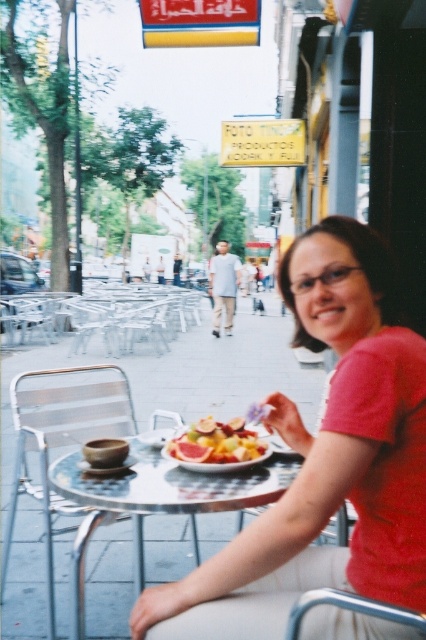
You are a photographer trying to capture a closeup shot of the matte red shirt at center without including the silver metallic chair at lower left in the frame. Based on their sizes, is this possible?

The matte red shirt at center has a lesser width compared to the silver metallic chair at lower left, so it is possible to capture a closeup shot of the matte red shirt at center without including the silver metallic chair at lower left in the frame.

You are a photographer setting up a tripod at the outdoor cafe. You need to place the tripod between the silver metallic chair at lower left and the clear glass table at center. The tripod requires a space that is at least as wide as the wider of the two objects. Which object determines the minimum width needed for the tripod placement?

The silver metallic chair at lower left might be wider than clear glass table at center, so the minimum width needed for the tripod placement should be based on the silver metallic chair at lower left to ensure it fits properly.

From the picture: You are a photographer setting up a tripod in the outdoor cafe. You need to position it between the silver metallic chair at lower left and the clear glass table at center. Is the space between them sufficient to place the tripod?

The clear glass table at center is behind the silver metallic chair at lower left, so there is no space between them to place the tripod.